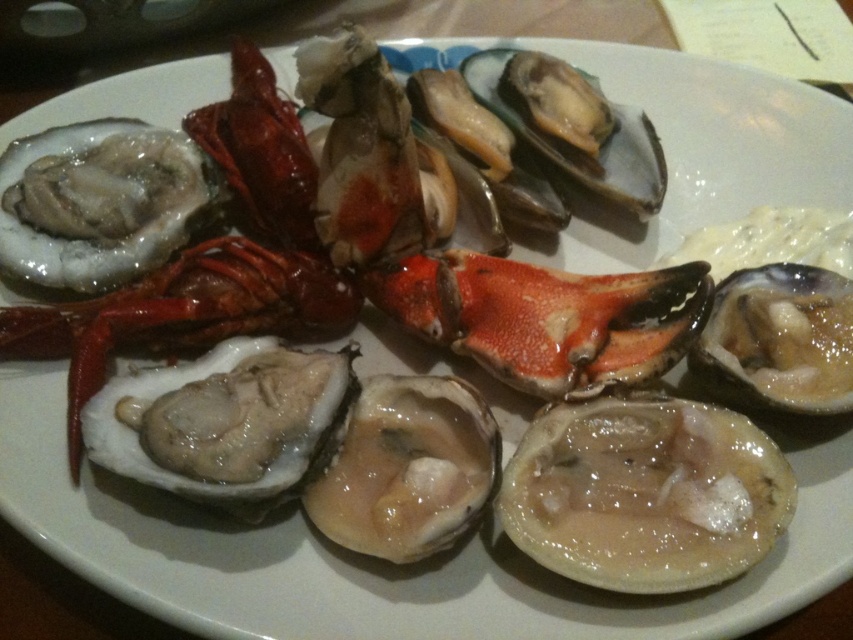
You are a food critic evaluating the arrangement of this seafood plate. Based on the positioning of the translucent gelatinous shellfish at center and the shiny red lobster at center, which one is closer to the viewer?

The translucent gelatinous shellfish at center is closer to the viewer because it is in front of the shiny red lobster at center.

You are a food critic standing at the edge of the table where the plate is placed. The table has a coordinate system where the bottom left corner is the origin point. You want to reach the shiny orange lobster claw at center. What are the coordinates of the point where you should aim your utensil?

The coordinates of the shiny orange lobster claw at center are at point (x=546, y=317). Therefore, you should aim your utensil at those coordinates to reach it.

You are a food critic who needs to taste each seafood item on the plate. Given that your utensils are 18 inches long, can you reach both the translucent gelatinous shellfish at center and the shiny red lobster at center without moving the plate?

The distance between the translucent gelatinous shellfish at center and the shiny red lobster at center is 20.24 inches. Since your utensils are only 18 inches long, you cannot reach both items without moving the plate because the distance exceeds the utensils length.